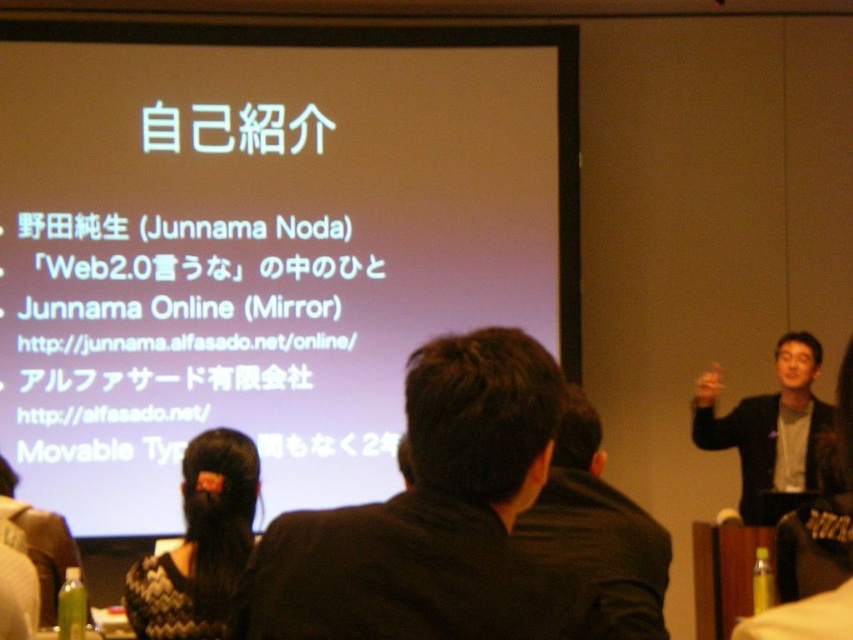
You are standing at the center of the image and want to move to the black knitted sweater at lower left. Which direction should you move in to reach it?

Since the black knitted sweater at lower left is located at point (x=200, y=544), you should move towards the lower left direction to reach it.

You are an event planner organizing a photoshoot for a clothing brand. You need to place a model wearing a black knitted sweater at lower left and another model in a black suit at right in a presentation scene. Based on the description, which model is positioned to the left of the other?

The black knitted sweater at lower left is positioned on the left side of black suit at right.

You are a photographer standing at the front of the presentation room. You want to take a photo that includes both the speaker and the projection. The speaker is at point (39,56) and the projection is at point (242,493). Since you want the speaker to be in focus, which point should you focus on?

You should focus on point (39,56) because it is closer to the camera than point (242,493), ensuring the speaker will be in focus.